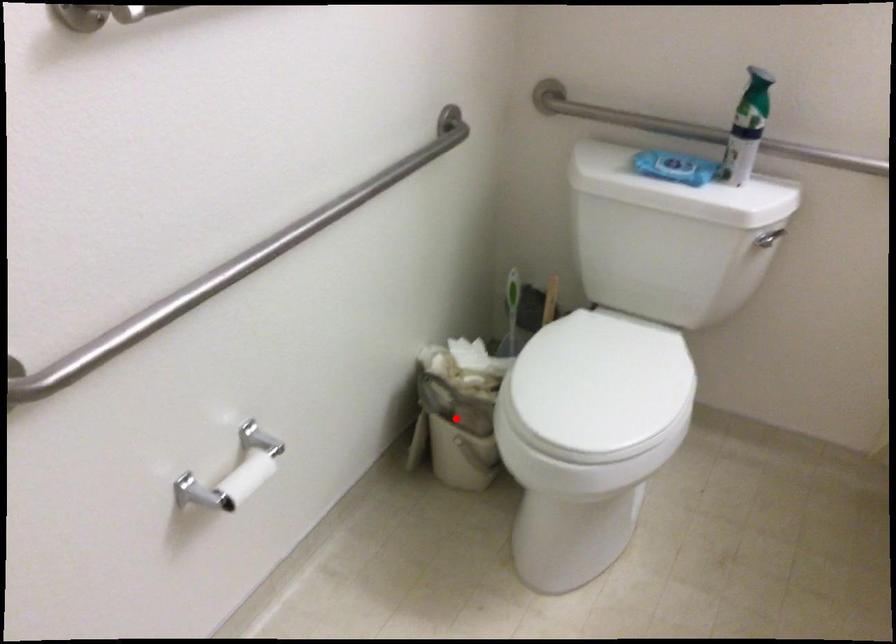
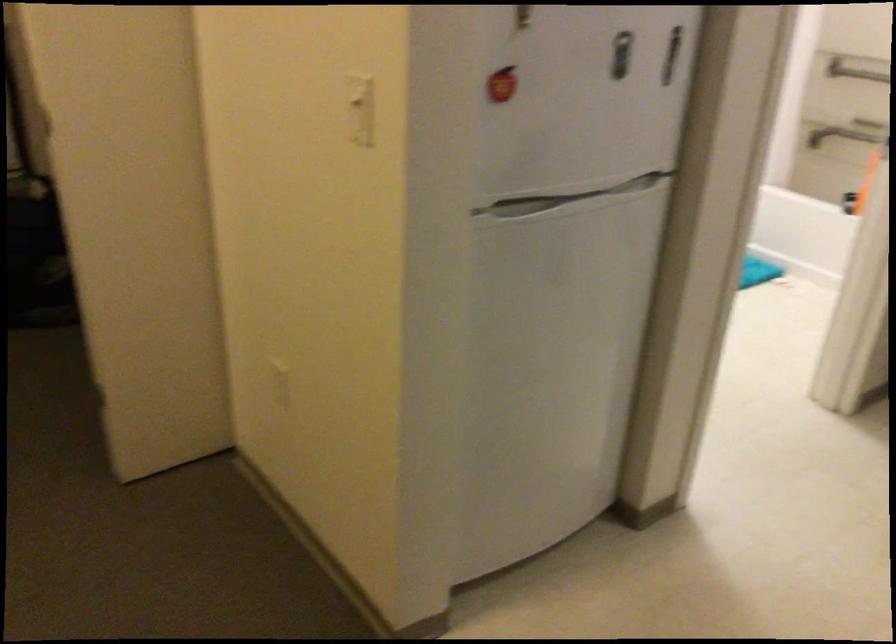
Question: I am providing you with two images of the same scene from different viewpoints. A red point is marked on the first image. Can you still see the location of the red point in image 2?

Choices:
 (A) Yes
 (B) No

Answer: (B)